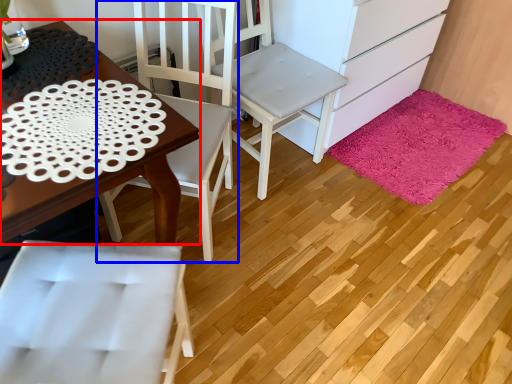
Question: Which object appears closest to the camera in this image, desk (highlighted by a red box) or chair (highlighted by a blue box)?

Choices:
 (A) desk
 (B) chair

Answer: (A)